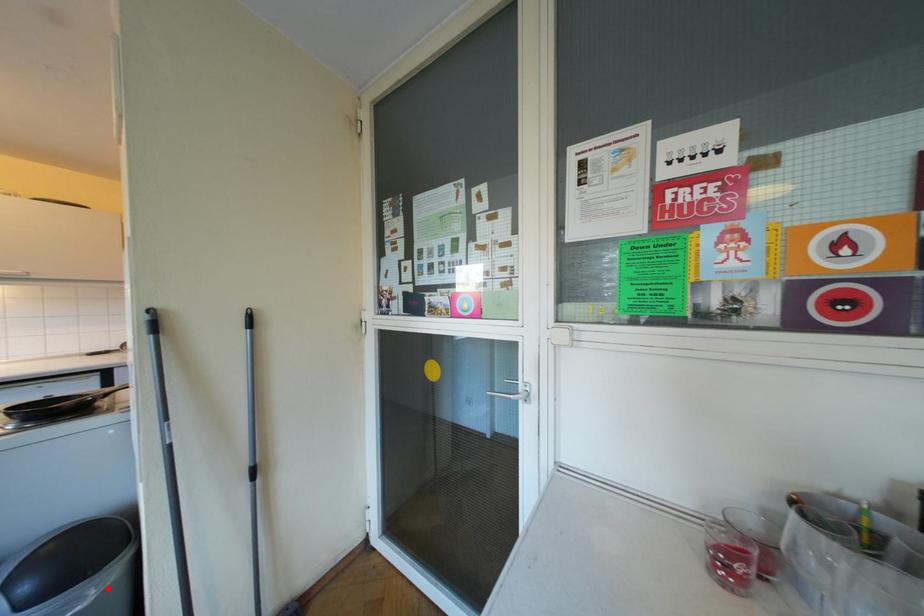
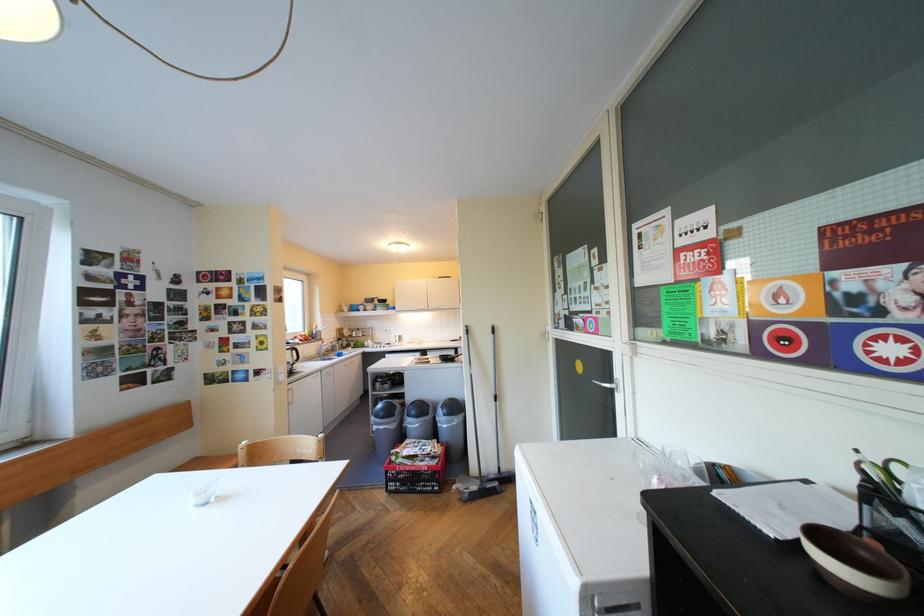
Locate, in the second image, the point that corresponds to the highlighted location in the first image.

(469, 419)